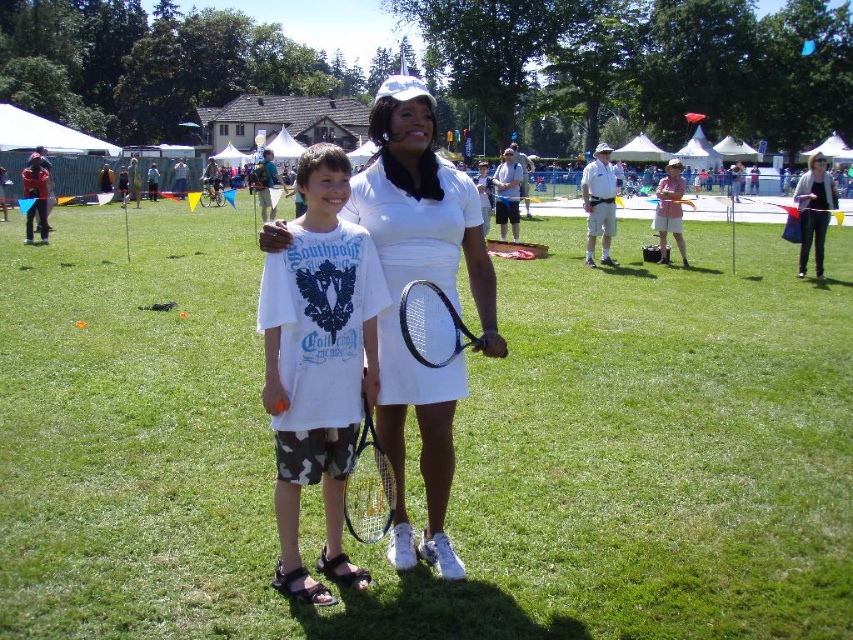
Question: Is white matte tennis dress at center positioned in front of metallic silver tennis racket at center?

Choices:
 (A) yes
 (B) no

Answer: (A)

Question: Can you confirm if white cotton t-shirt at center is bigger than white matte tennis dress at center?

Choices:
 (A) no
 (B) yes

Answer: (A)

Question: Which of the following is the farthest from the observer?

Choices:
 (A) white cotton dress at center
 (B) black matte tennis racket at center
 (C) metallic silver tennis racket at center

Answer: (A)

Question: Is black matte tennis racket at center above white cotton dress at center?

Choices:
 (A) yes
 (B) no

Answer: (B)

Question: Among these points, which one is nearest to the camera?

Choices:
 (A) (378, 300)
 (B) (815, 241)
 (C) (374, 506)
 (D) (402, 305)

Answer: (D)

Question: Which point is farther to the camera?

Choices:
 (A) black matte tennis racket at center
 (B) white cotton t-shirt at center
 (C) white matte tennis dress at center

Answer: (B)